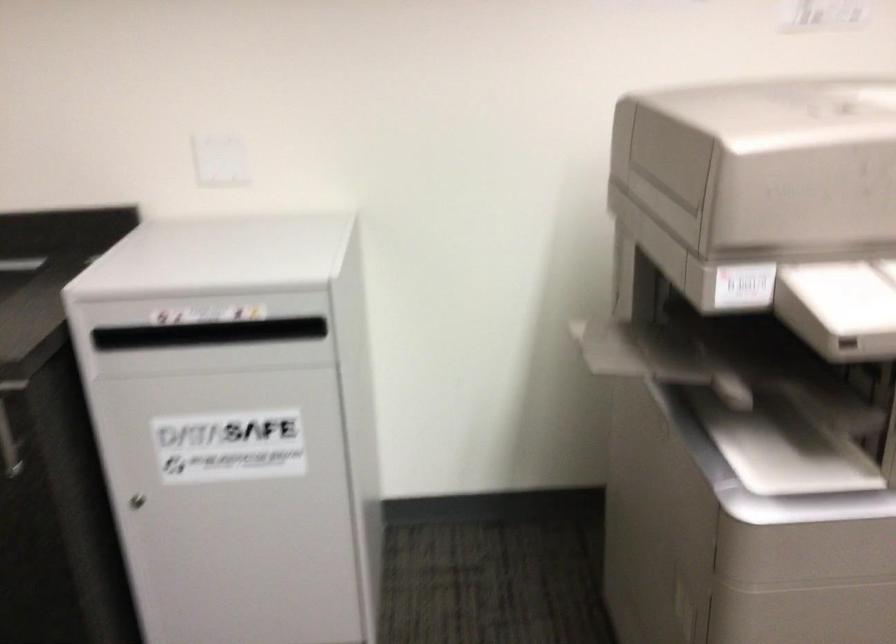
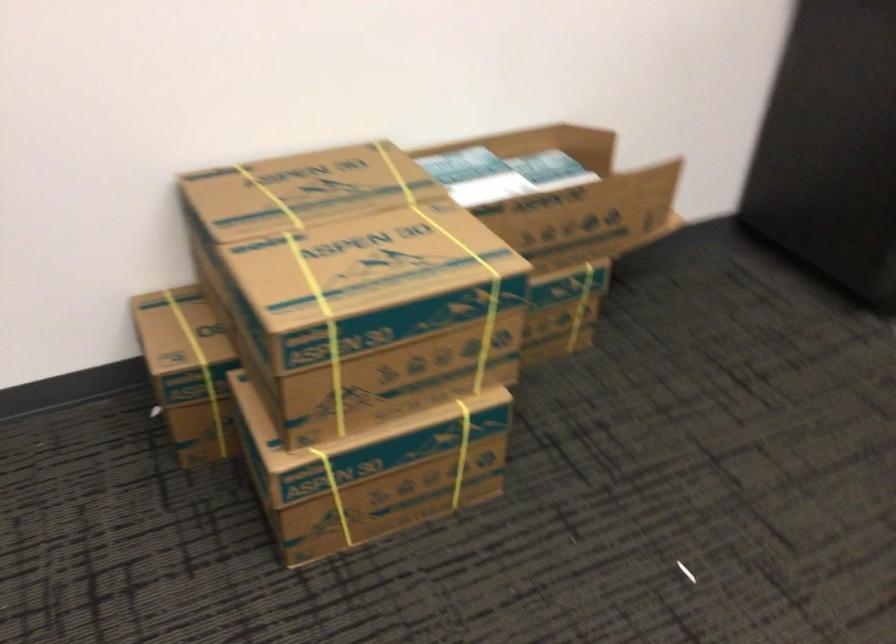
The first image is from the beginning of the video and the second image is from the end. How did the camera likely rotate when shooting the video?

The camera rotated toward left-down.